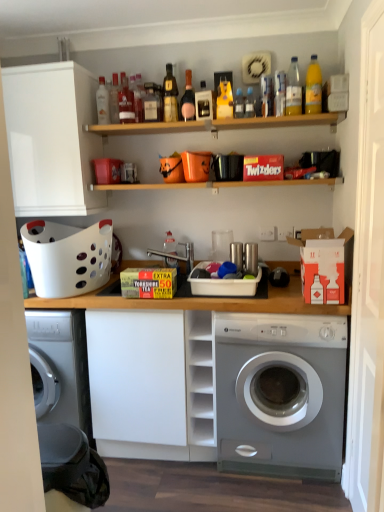
Question: Choose the correct answer: Is wooden shelf at upper center inside matte glass bottle at upper center, the sixth bottle viewed from the left, or outside it?

Choices:
 (A) outside
 (B) inside

Answer: (A)

Question: Relative to matte glass bottle at upper center, the fifth bottle viewed from the right, is wooden shelf at upper center in front or behind?

Choices:
 (A) front
 (B) behind

Answer: (A)

Question: Which object is the farthest from the white plastic basket at center, the first basket in the right-to-left sequence?

Choices:
 (A) translucent glass bottle at upper center, the second bottle viewed from the left
 (B) matte white bottle at center, which ranks as the 4th bottle in left-to-right order
 (C) satin silver washing machine at lower right
 (D) cardboard box at center, which is the 2th cardboard box in right-to-left order
 (E) yellow plastic bottle at upper center, which is the fourth bottle from right to left

Answer: (A)

Question: Considering the real-world distances, which object is closest to the matte glass bottle at upper center, the fifth bottle viewed from the right?

Choices:
 (A) matte white bottle at center, which ranks as the 4th bottle in left-to-right order
 (B) white cardboard box at right, which appears as the 2th cardboard box when viewed from the left
 (C) yellow plastic bottle at upper center, acting as the 7th bottle starting from the left
 (D) translucent glass bottle at upper center, the 9th bottle in the right-to-left sequence
 (E) translucent glass bottle at upper center, acting as the fifth bottle starting from the left

Answer: (E)